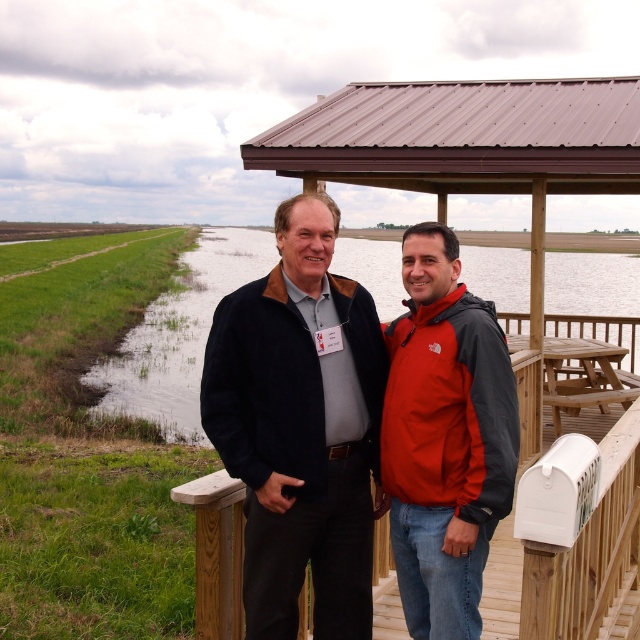
Question: Estimate the real-world distances between objects in this image. Which object is farther from the matte red jacket at center?

Choices:
 (A) green grass at lower left
 (B) wooden at center

Answer: (A)

Question: From the image, what is the correct spatial relationship of matte black jacket at center in relation to green grass at lower left?

Choices:
 (A) below
 (B) above

Answer: (A)

Question: Can you confirm if matte red jacket at center is wider than wooden at center?

Choices:
 (A) no
 (B) yes

Answer: (A)

Question: Is matte red jacket at center thinner than green grass at lower left?

Choices:
 (A) yes
 (B) no

Answer: (A)

Question: Which object appears closest to the camera in this image?

Choices:
 (A) green grass at lower left
 (B) matte red jacket at center

Answer: (B)

Question: Based on their relative distances, which object is farther from the matte black jacket at center?

Choices:
 (A) wooden at center
 (B) green grass at lower left
 (C) matte red jacket at center

Answer: (B)